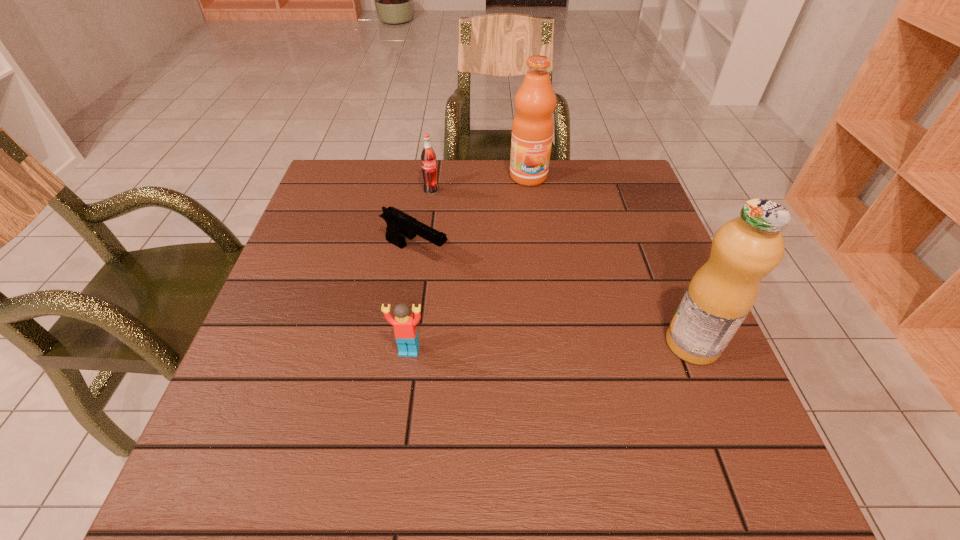
Identify the location of vacant space located 0.340m on the front-facing side of the shortest object. Image resolution: width=960 pixels, height=540 pixels. (572, 335).

In order to click on fruit juice situated at the far edge in this screenshot , I will do `click(532, 129)`.

The height and width of the screenshot is (540, 960). Find the location of `soda bottle that is at the far edge`. soda bottle that is at the far edge is located at coordinates (428, 157).

Find the location of a particular element. The width and height of the screenshot is (960, 540). object located at the right edge is located at coordinates (745, 249).

This screenshot has width=960, height=540. Identify the location of vacant point at the far edge. (470, 181).

At what (x,y) coordinates should I click in order to perform the action: click on free space at the near edge of the desktop. Please return your answer as a coordinate pair (x, y). Image resolution: width=960 pixels, height=540 pixels. Looking at the image, I should click on (424, 395).

Identify the location of vacant space at the left edge. (278, 283).

At what (x,y) coordinates should I click in order to perform the action: click on free space at the right edge. Please return your answer as a coordinate pair (x, y). The image size is (960, 540). Looking at the image, I should click on (615, 255).

In the image, there is a desktop. At what (x,y) coordinates should I click in order to perform the action: click on vacant space at the far left corner. Please return your answer as a coordinate pair (x, y). Looking at the image, I should click on click(x=327, y=175).

Identify the location of free space at the far right corner of the desktop. (606, 200).